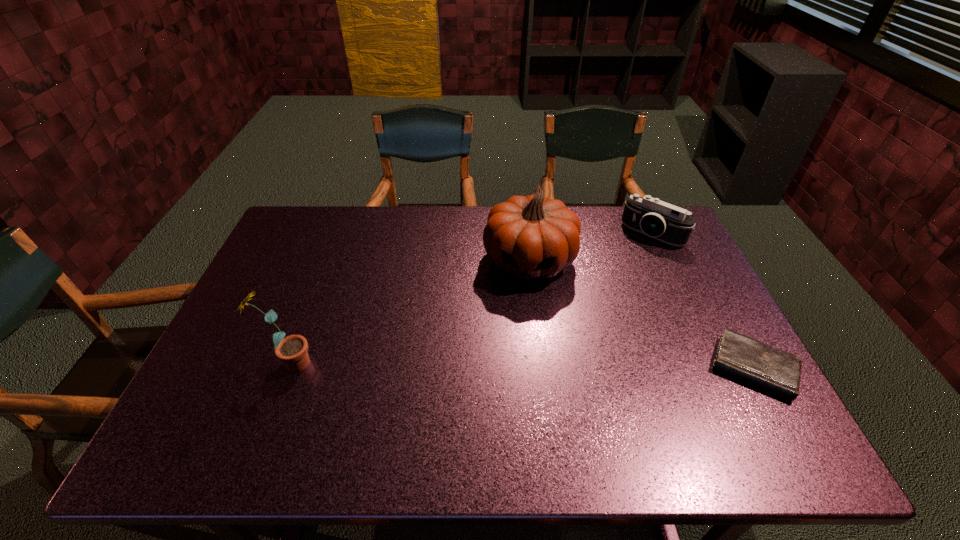
Locate an element on the screen. Image resolution: width=960 pixels, height=540 pixels. the leftmost object is located at coordinates (292, 350).

I want to click on the shortest object, so click(759, 364).

In order to click on the second object from left to right in this screenshot , I will do `click(532, 236)`.

This screenshot has width=960, height=540. In order to click on the second shortest object in this screenshot , I will do `click(650, 216)`.

The image size is (960, 540). Identify the location of free spot located 0.110m on the flower of the sunflower. (357, 363).

At what (x,y) coordinates should I click in order to perform the action: click on blank space located on the left of the shortest object. Please return your answer as a coordinate pair (x, y). The image size is (960, 540). Looking at the image, I should click on (620, 368).

This screenshot has height=540, width=960. What are the coordinates of `vacant space located on the face of the second object from left to right` in the screenshot? It's located at (505, 408).

The image size is (960, 540). I want to click on free space located on the face of the second object from left to right, so click(x=516, y=343).

Find the location of a particular element. vacant space located on the face of the second object from left to right is located at coordinates (522, 305).

This screenshot has width=960, height=540. Find the location of `free space located 0.270m on the front lens of the second shortest object`. free space located 0.270m on the front lens of the second shortest object is located at coordinates (599, 292).